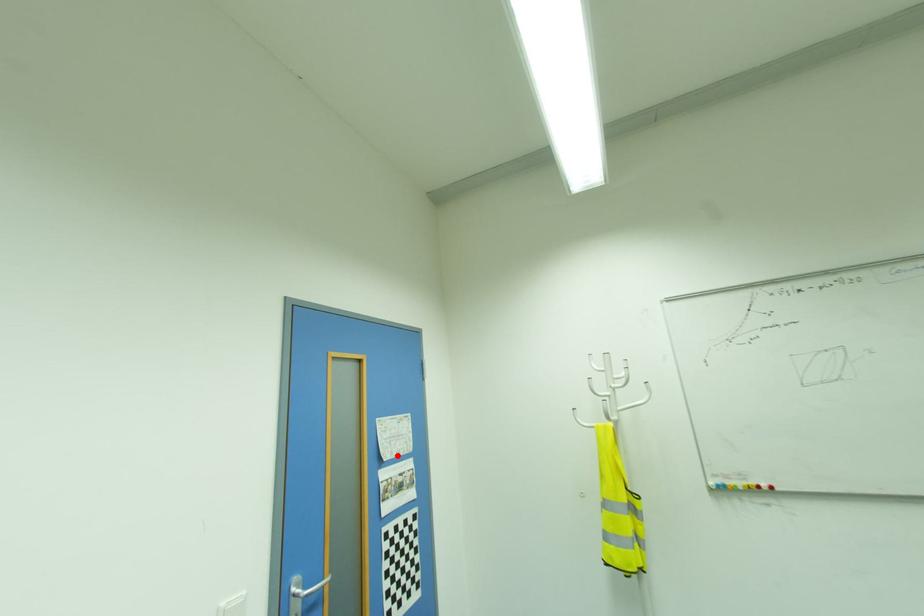
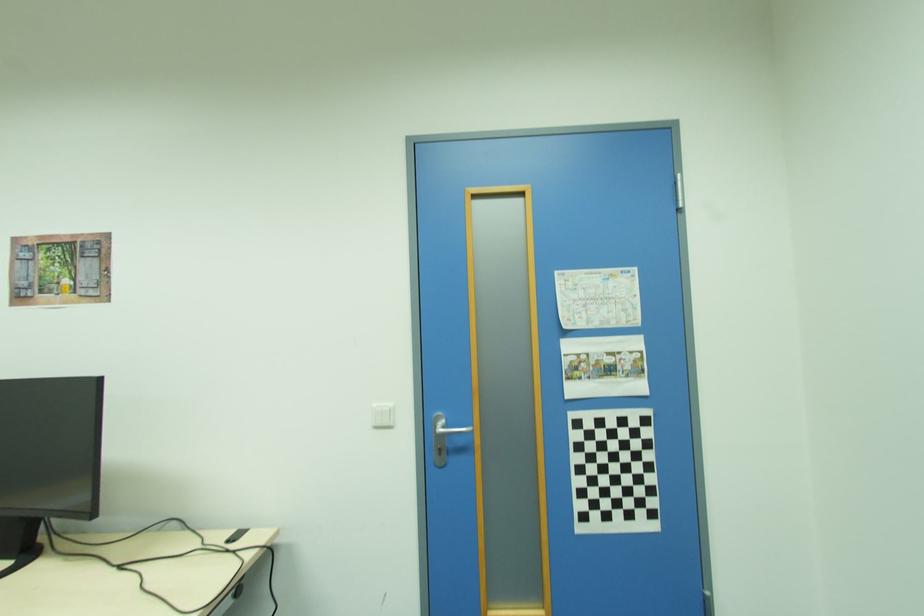
Locate, in the second image, the point that corresponds to the highlighted location in the first image.

(599, 325)